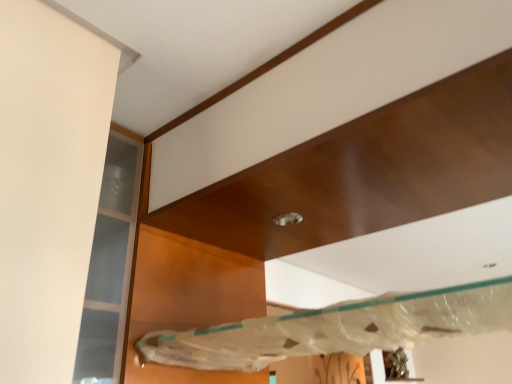
The height and width of the screenshot is (384, 512). Identify the location of matte brown dresser at upper center. (319, 206).

What do you see at coordinates (319, 206) in the screenshot? The height and width of the screenshot is (384, 512). I see `matte brown dresser at upper center` at bounding box center [319, 206].

Where is `matte brown dresser at upper center`? The image size is (512, 384). matte brown dresser at upper center is located at coordinates (319, 206).